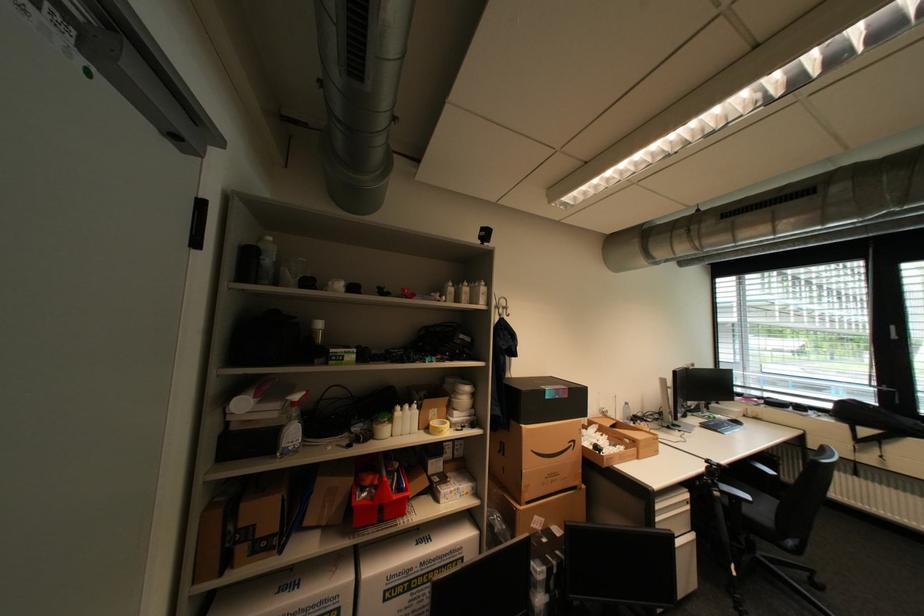
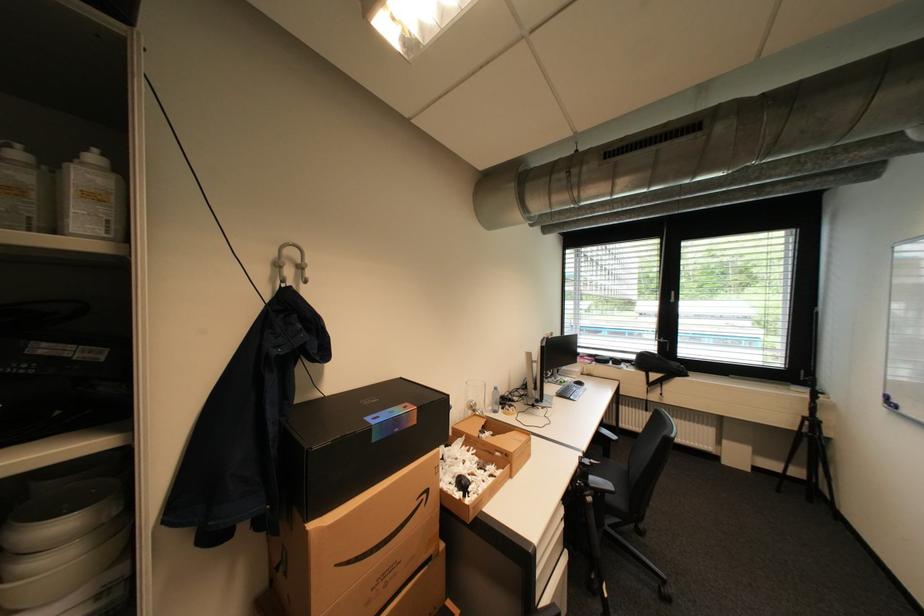
The point at (580, 444) is marked in the first image. Where is the corresponding point in the second image?

(433, 496)